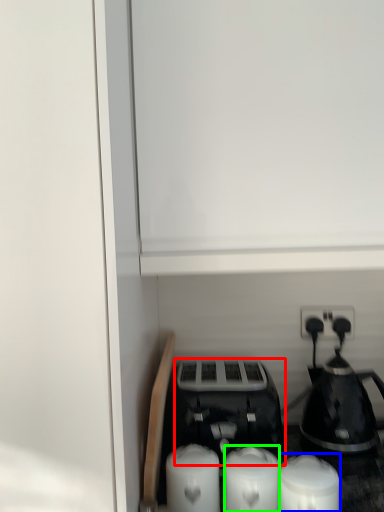
Question: Considering the real-world distances, which object is closest to toaster (highlighted by a red box)? candle (highlighted by a blue box) or candle (highlighted by a green box).

Choices:
 (A) candle
 (B) candle

Answer: (B)